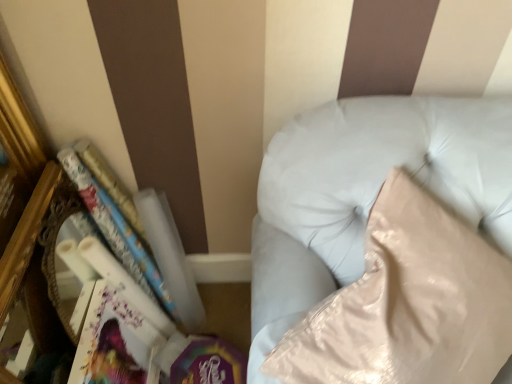
Question: Is matte white paperback book at lower left positioned far away from white glossy book at left?

Choices:
 (A) no
 (B) yes

Answer: (A)

Question: Is matte white paperback book at lower left positioned behind white glossy book at left?

Choices:
 (A) no
 (B) yes

Answer: (B)

Question: Can white glossy book at left be found inside matte white paperback book at lower left?

Choices:
 (A) no
 (B) yes

Answer: (A)

Question: Is matte white paperback book at lower left wider than white glossy book at left?

Choices:
 (A) yes
 (B) no

Answer: (B)

Question: From the image's perspective, is matte white paperback book at lower left on white glossy book at left?

Choices:
 (A) no
 (B) yes

Answer: (A)

Question: Choose the correct answer: Is white leather couch at upper right inside white glossy book at left or outside it?

Choices:
 (A) outside
 (B) inside

Answer: (A)

Question: Considering the positions of point (355, 216) and point (81, 155), is point (355, 216) closer or farther from the camera than point (81, 155)?

Choices:
 (A) farther
 (B) closer

Answer: (B)

Question: Considering the positions of white leather couch at upper right and white glossy book at left in the image, is white leather couch at upper right wider or thinner than white glossy book at left?

Choices:
 (A) thin
 (B) wide

Answer: (B)

Question: From the image's perspective, is white leather couch at upper right located above or below white glossy book at left?

Choices:
 (A) below
 (B) above

Answer: (A)

Question: Is white glossy book at left situated inside white leather couch at upper right or outside?

Choices:
 (A) inside
 (B) outside

Answer: (B)

Question: In terms of size, does white glossy book at left appear bigger or smaller than white leather couch at upper right?

Choices:
 (A) big
 (B) small

Answer: (B)

Question: From their relative heights in the image, would you say white glossy book at left is taller or shorter than white leather couch at upper right?

Choices:
 (A) short
 (B) tall

Answer: (B)

Question: From a real-world perspective, is white glossy book at left physically located above or below white leather couch at upper right?

Choices:
 (A) above
 (B) below

Answer: (B)

Question: From the image's perspective, is matte white paperback book at lower left located above or below white leather couch at upper right?

Choices:
 (A) above
 (B) below

Answer: (B)

Question: Based on their sizes in the image, would you say matte white paperback book at lower left is bigger or smaller than white leather couch at upper right?

Choices:
 (A) big
 (B) small

Answer: (B)